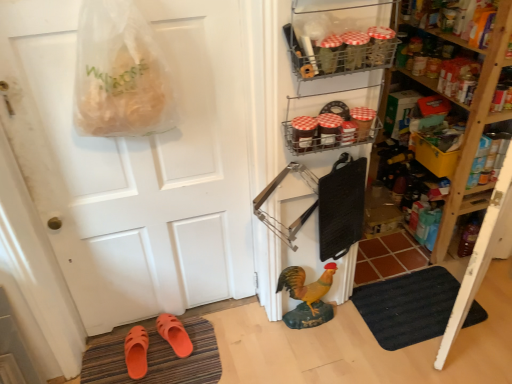
Locate an element on the screen. The width and height of the screenshot is (512, 384). vacant region to the left of orange rubber slippers at lower left, the first footwear when ordered from left to right is located at coordinates (103, 358).